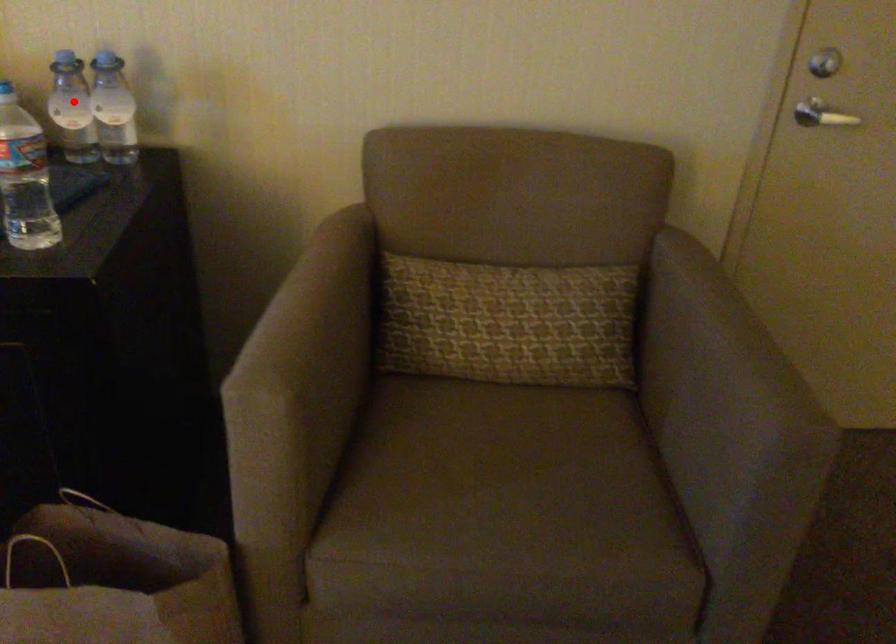
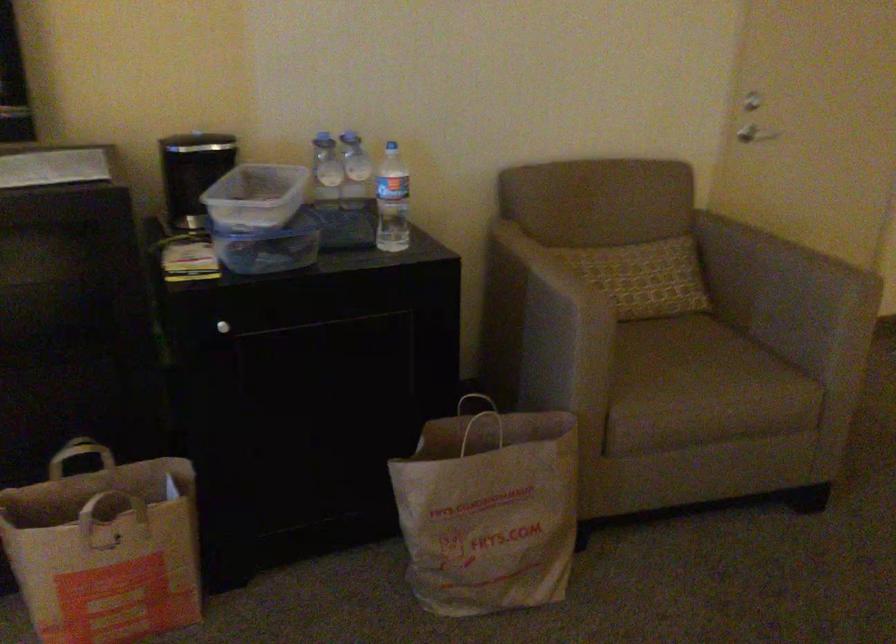
Question: I am providing you with two images of the same scene from different viewpoints. In image1, a red point is highlighted. Considering the same 3D point in image2, which of the following is correct?

Choices:
 (A) It is closer
 (B) It is farther

Answer: (B)